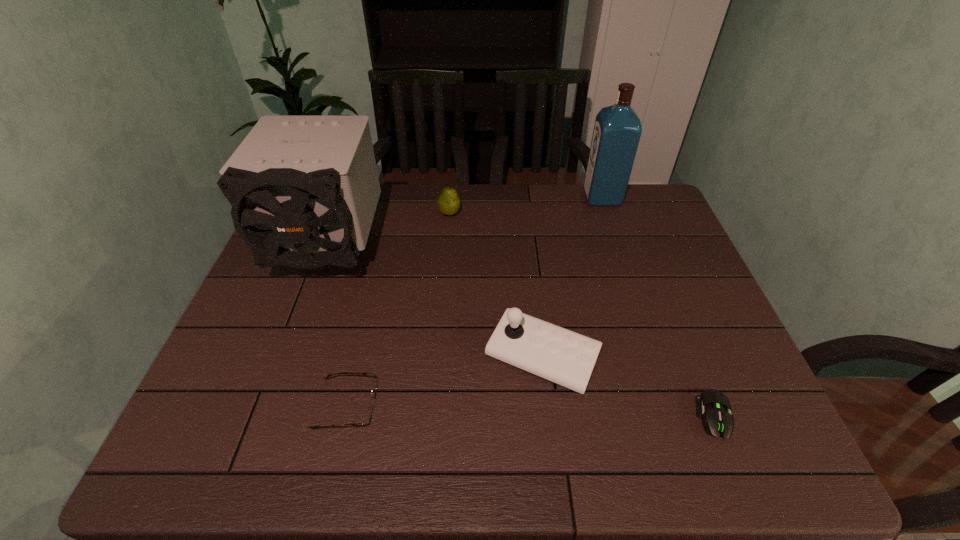
In order to click on liquor in this screenshot , I will do `click(617, 130)`.

Where is `fan`? This screenshot has height=540, width=960. fan is located at coordinates (304, 189).

Where is `joystick`? Image resolution: width=960 pixels, height=540 pixels. joystick is located at coordinates (567, 358).

At what (x,y) coordinates should I click in order to perform the action: click on pear. Please return your answer as a coordinate pair (x, y). Image resolution: width=960 pixels, height=540 pixels. Looking at the image, I should click on (448, 203).

Where is `the third shortest object`? the third shortest object is located at coordinates (448, 203).

The width and height of the screenshot is (960, 540). Identify the location of spectacles. (367, 420).

Locate an element on the screen. The image size is (960, 540). the shortest object is located at coordinates tap(717, 417).

Identify the location of free space located on the flat label side of the liquor. The height and width of the screenshot is (540, 960). (506, 198).

Find the location of a particular element. free region located on the flat label side of the liquor is located at coordinates (547, 198).

The width and height of the screenshot is (960, 540). I want to click on free space located 0.310m on the flat label side of the liquor, so click(x=494, y=198).